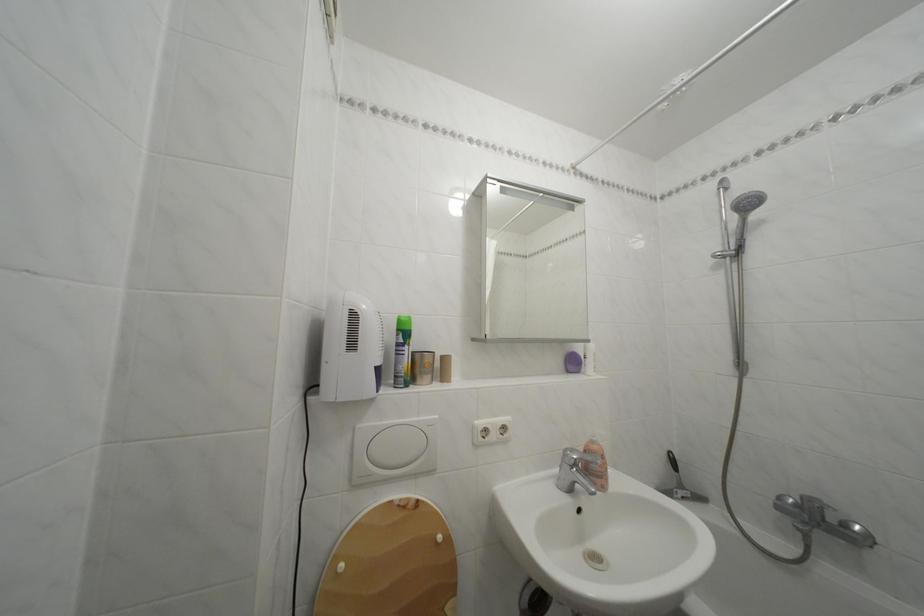
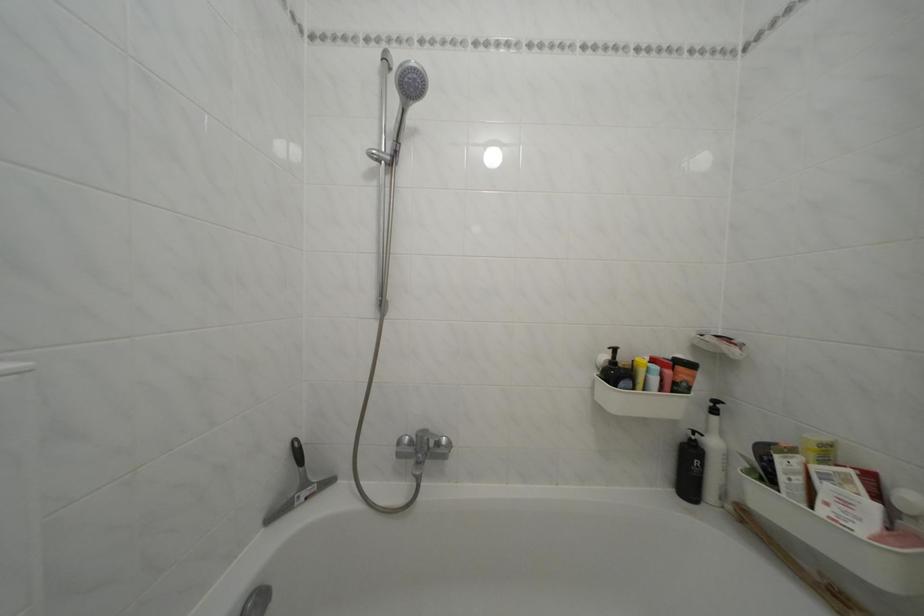
Question: The first image is from the beginning of the video and the second image is from the end. How did the camera likely rotate when shooting the video?

Choices:
 (A) Left
 (B) Right
 (C) Up
 (D) Down

Answer: (B)